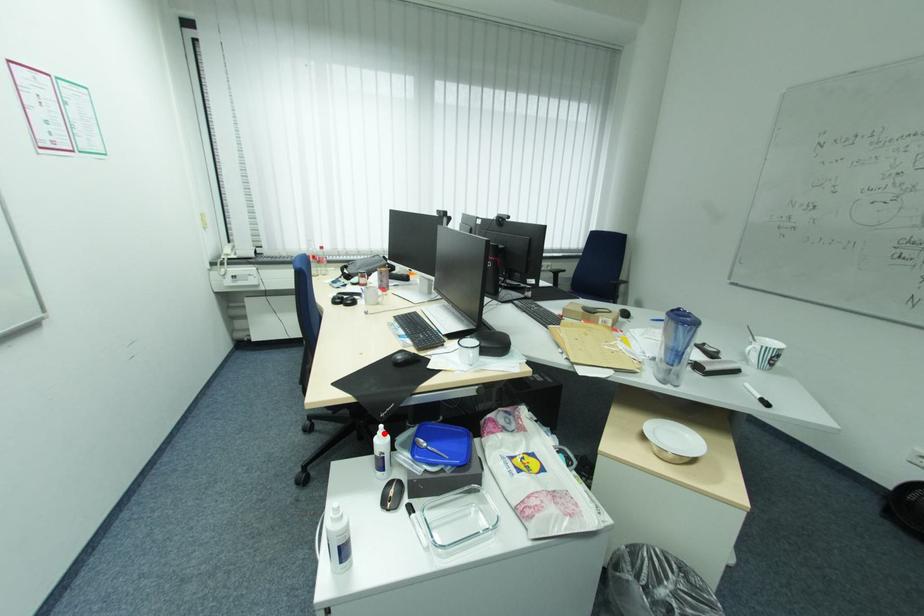
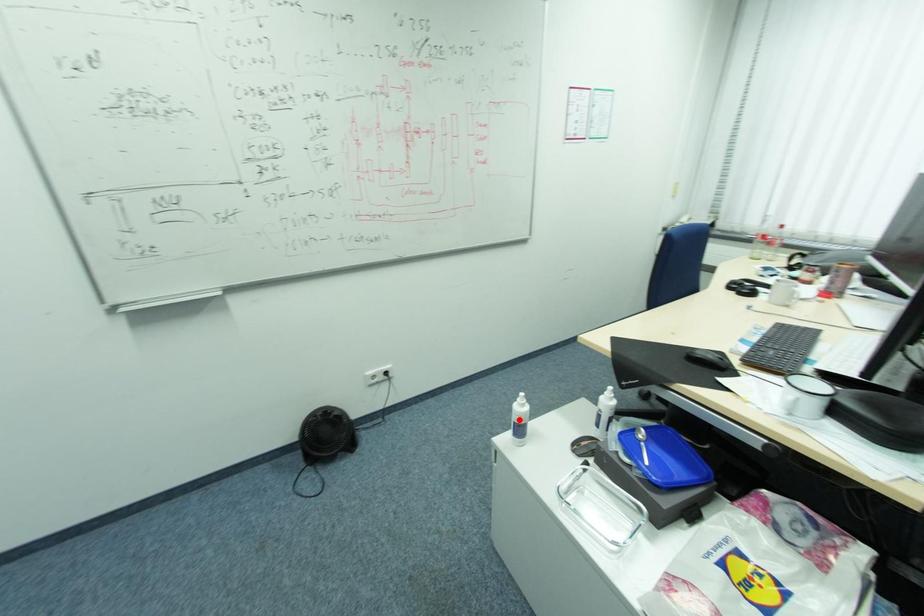
I am providing you with two images of the same scene from different viewpoints. A red point is marked on the first image and another point is marked on the second image. Is the red point in image1 aligned with the point shown in image2?

No